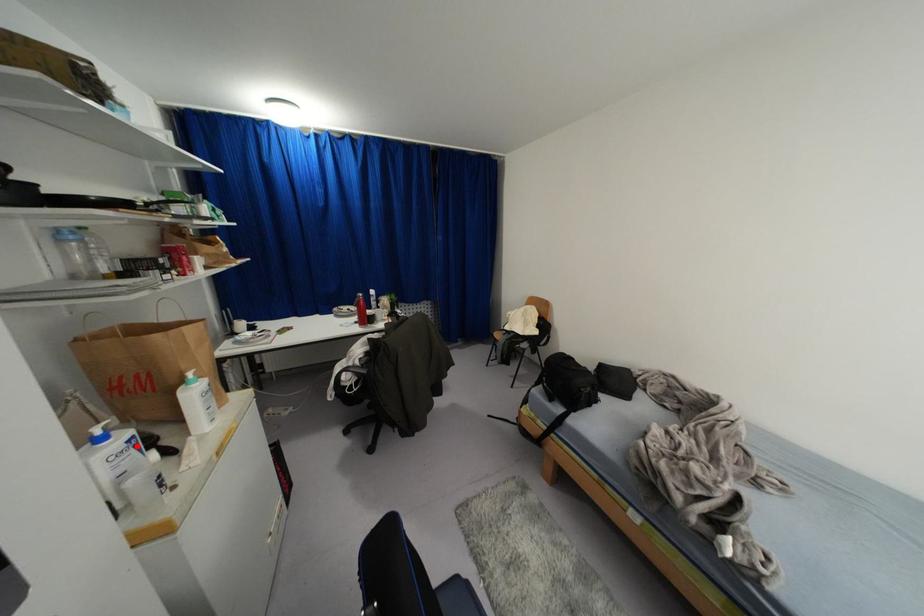
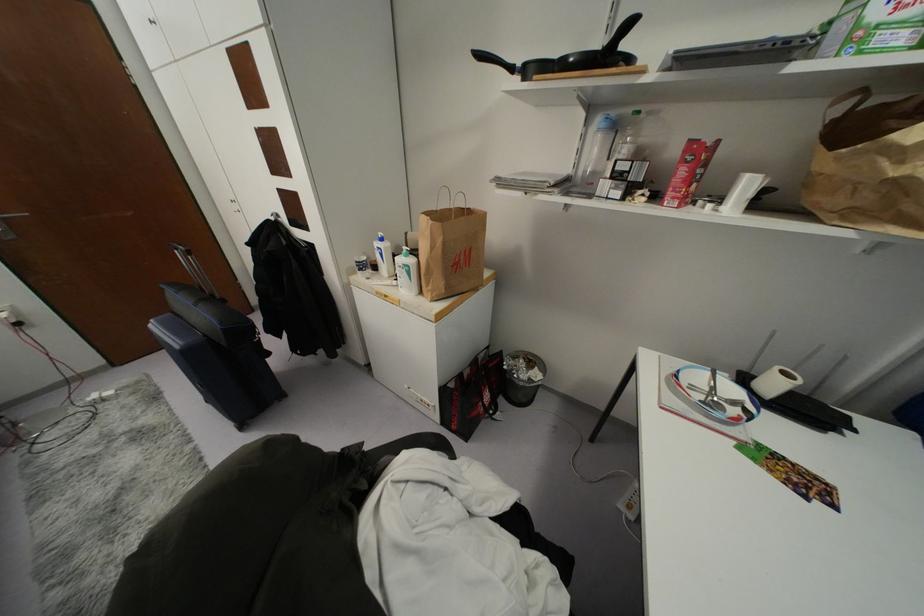
Find the pixel in the second image that matches the highlighted location in the first image.

(381, 254)